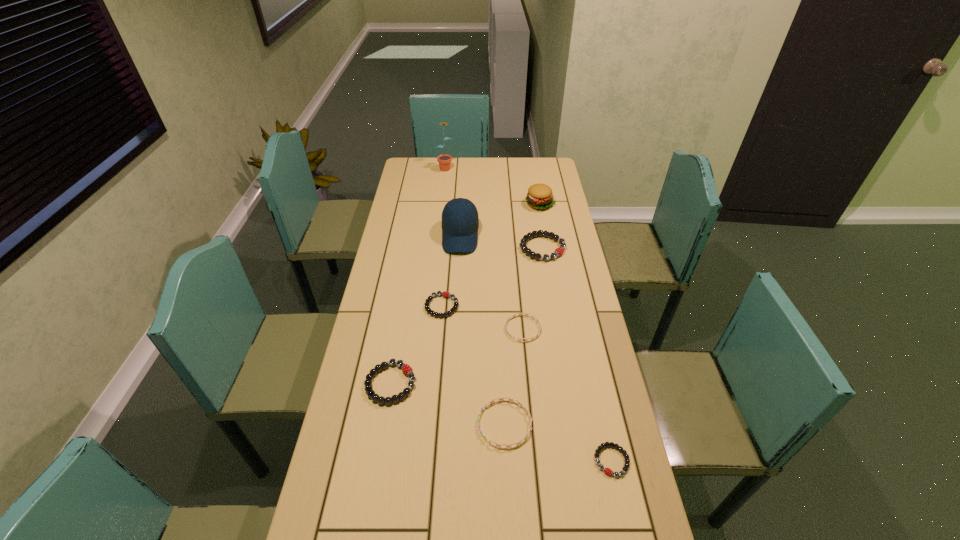
Image resolution: width=960 pixels, height=540 pixels. I want to click on hamburger located at the right edge, so click(540, 196).

The height and width of the screenshot is (540, 960). I want to click on object that is positioned at the far left corner, so click(x=444, y=160).

In the image, there is a desktop. Where is `vacant space at the far edge`? The image size is (960, 540). vacant space at the far edge is located at coordinates (473, 158).

At what (x,y) coordinates should I click in order to perform the action: click on free space at the left edge. Please return your answer as a coordinate pair (x, y). The width and height of the screenshot is (960, 540). Looking at the image, I should click on (422, 190).

This screenshot has height=540, width=960. Find the location of `vacant area at the right edge of the desktop`. vacant area at the right edge of the desktop is located at coordinates (582, 369).

I want to click on vacant space at the far right corner of the desktop, so click(x=552, y=167).

At what (x,y) coordinates should I click in order to perform the action: click on free space between the smallest black bracelet and the third tallest object. Please return your answer as a coordinate pair (x, y). The width and height of the screenshot is (960, 540). Looking at the image, I should click on (576, 332).

In order to click on free space between the second farthest object and the third biggest black bracelet in this screenshot , I will do `click(491, 255)`.

Where is `empty space that is in between the second tallest object and the biggest black bracelet`? The height and width of the screenshot is (540, 960). empty space that is in between the second tallest object and the biggest black bracelet is located at coordinates (501, 242).

Where is `vacant area between the third tallest object and the tallest object`? vacant area between the third tallest object and the tallest object is located at coordinates (492, 185).